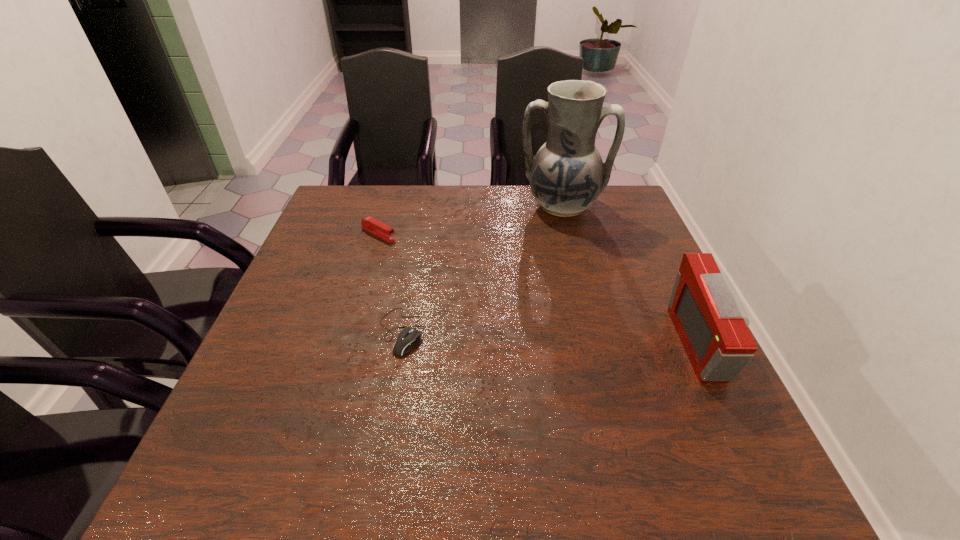
Where is `object located in the far left corner section of the desktop`? object located in the far left corner section of the desktop is located at coordinates (370, 224).

Where is `object that is at the far right corner`? The image size is (960, 540). object that is at the far right corner is located at coordinates (567, 175).

Find the location of a particular element. Image resolution: width=960 pixels, height=540 pixels. vacant space at the far edge of the desktop is located at coordinates click(x=444, y=203).

In the image, there is a desktop. Where is `free region at the left edge`? free region at the left edge is located at coordinates click(x=313, y=366).

Find the location of a particular element. The image size is (960, 540). free location at the right edge of the desktop is located at coordinates (607, 241).

This screenshot has height=540, width=960. In order to click on free space at the far left corner of the desktop in this screenshot , I will do [x=322, y=222].

Locate an element on the screen. The height and width of the screenshot is (540, 960). free point at the near left corner is located at coordinates (308, 414).

Identify the location of unoccupied position between the shortest object and the second shortest object. [x=390, y=283].

Where is `free space between the third object from left to right and the stapler`? The height and width of the screenshot is (540, 960). free space between the third object from left to right and the stapler is located at coordinates (470, 221).

Locate an element on the screen. This screenshot has width=960, height=540. vacant area between the third shortest object and the stapler is located at coordinates (540, 289).